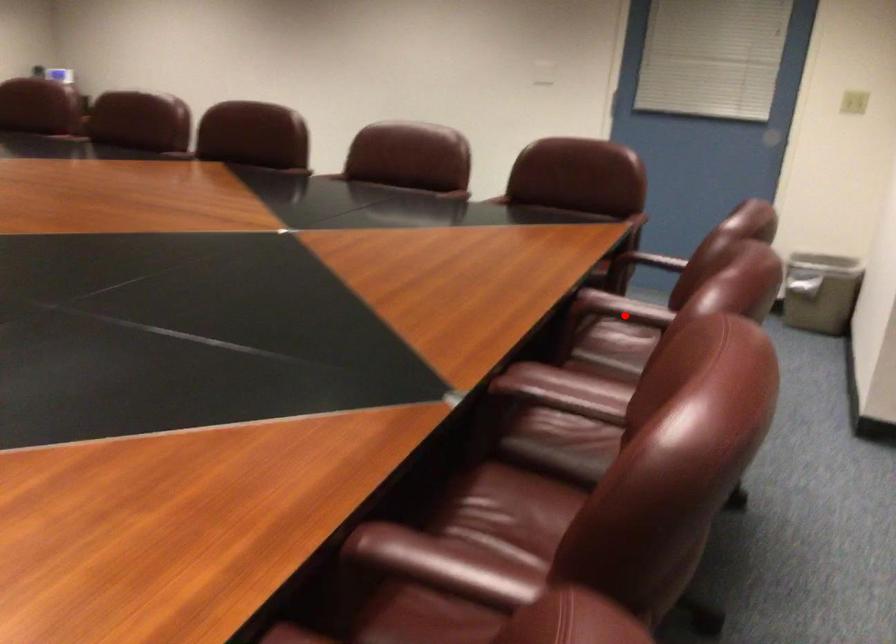
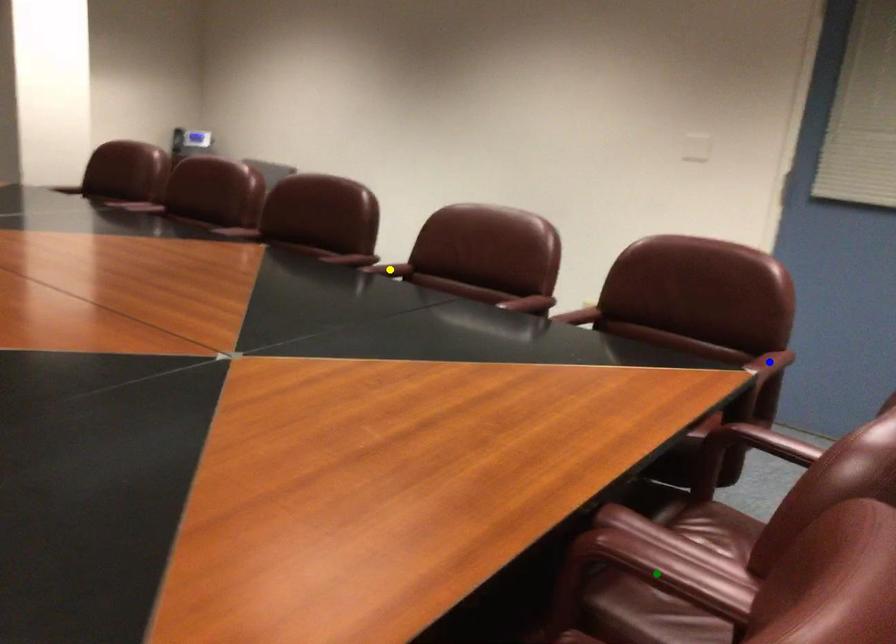
Question: I am providing you with two images of the same scene from different viewpoints. A red point is marked on the first image. You are given multiple points on the second image. Which spot in image 2 lines up with the point in image 1?

Choices:
 (A) yellow point
 (B) blue point
 (C) green point

Answer: (C)